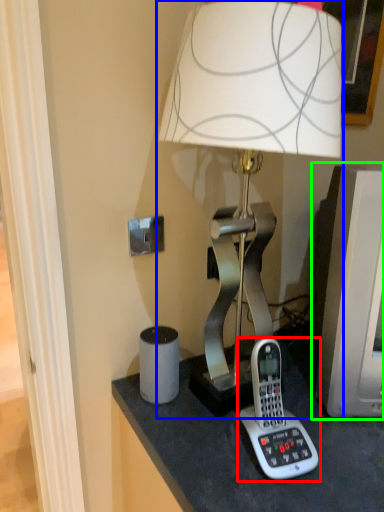
Question: Which object is positioned farthest from corded phone (highlighted by a red box)? Select from lamp (highlighted by a blue box) and computer monitor (highlighted by a green box).

Choices:
 (A) lamp
 (B) computer monitor

Answer: (A)